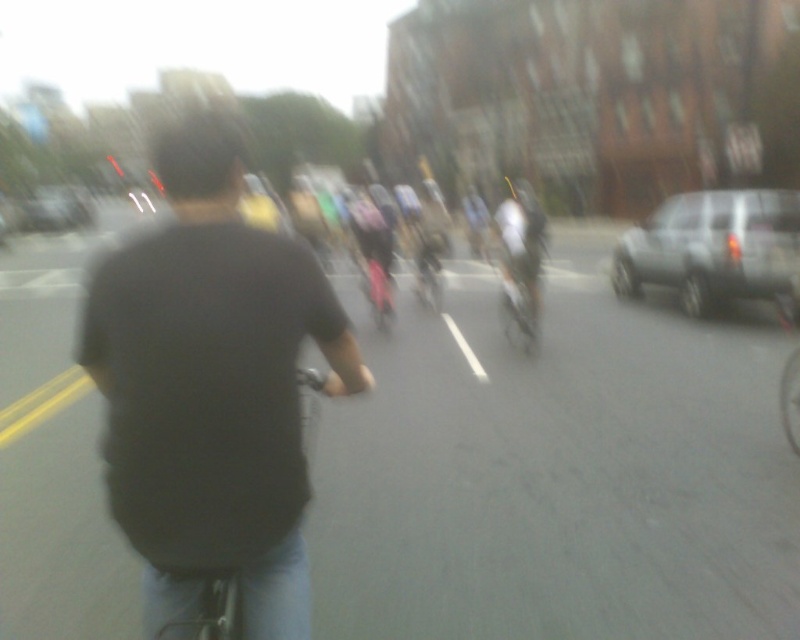
Can you confirm if black matte shirt at center is positioned to the right of black matte bicycle at center?

Incorrect, black matte shirt at center is not on the right side of black matte bicycle at center.

Which is above, black matte shirt at center or black matte bicycle at center?

black matte bicycle at center

Who is more forward, (293, 252) or (198, 604)?

Point (293, 252) is in front.

Where is `black matte shirt at center`? The width and height of the screenshot is (800, 640). black matte shirt at center is located at coordinates (212, 388).

Can you confirm if black matte bicycle at center is positioned to the left of silver metallic bicycle at center?

Yes, black matte bicycle at center is to the left of silver metallic bicycle at center.

In the scene shown: Which of these two, black matte bicycle at center or silver metallic bicycle at center, stands taller?

With more height is silver metallic bicycle at center.

Where is `black matte bicycle at center`? This screenshot has width=800, height=640. black matte bicycle at center is located at coordinates (230, 600).

Identify the location of black matte bicycle at center. (230, 600).

Looking at this image, does silver metallic suv at right appear under silver metallic bicycle at center?

No, silver metallic suv at right is not below silver metallic bicycle at center.

Between point (784, 220) and point (492, 266), which one is positioned in front?

Point (784, 220) is in front.

Where is `silver metallic suv at right`? This screenshot has height=640, width=800. silver metallic suv at right is located at coordinates (716, 250).